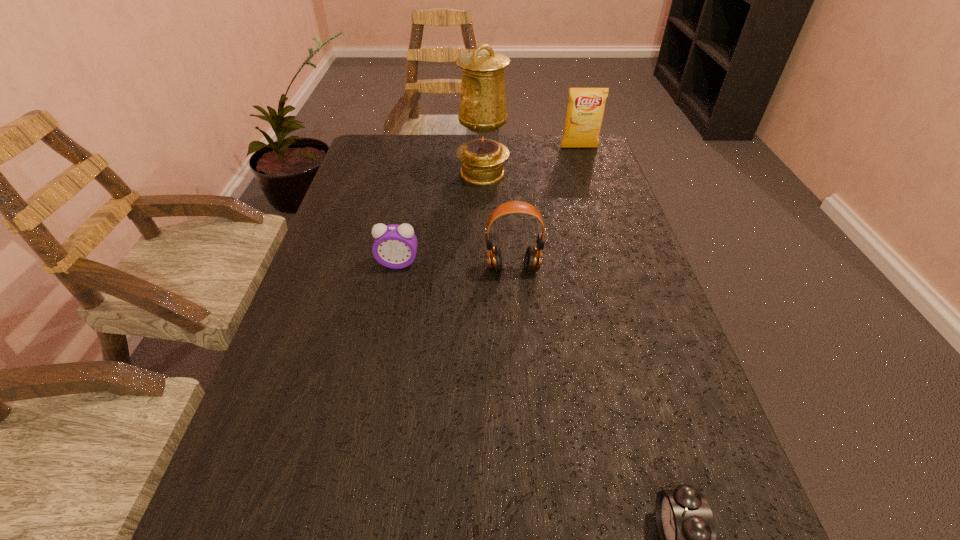
Locate an element on the screen. oil lamp located at the far edge is located at coordinates (482, 111).

Where is `crisp (potato chip) present at the far edge`? crisp (potato chip) present at the far edge is located at coordinates (585, 110).

Locate an element on the screen. object situated at the left edge is located at coordinates (395, 246).

Find the location of a particular element. This screenshot has width=960, height=540. object positioned at the right edge is located at coordinates (585, 110).

Where is `object present at the far right corner`? The width and height of the screenshot is (960, 540). object present at the far right corner is located at coordinates (585, 110).

Locate an element on the screen. The width and height of the screenshot is (960, 540). free region at the far edge is located at coordinates (462, 141).

The height and width of the screenshot is (540, 960). In the image, there is a desktop. Identify the location of free space at the left edge. coord(318,249).

The height and width of the screenshot is (540, 960). Identify the location of free space at the right edge of the desktop. (677, 360).

You are a GUI agent. You are given a task and a screenshot of the screen. Output one action in this format:
    pyautogui.click(x=<x>, y=<y>)
    Task: Click on the vacant point at the far left corner
    
    Given the screenshot: What is the action you would take?
    pyautogui.click(x=366, y=154)

Identify the location of blank space at the far right corner of the desktop. The height and width of the screenshot is (540, 960). (598, 154).